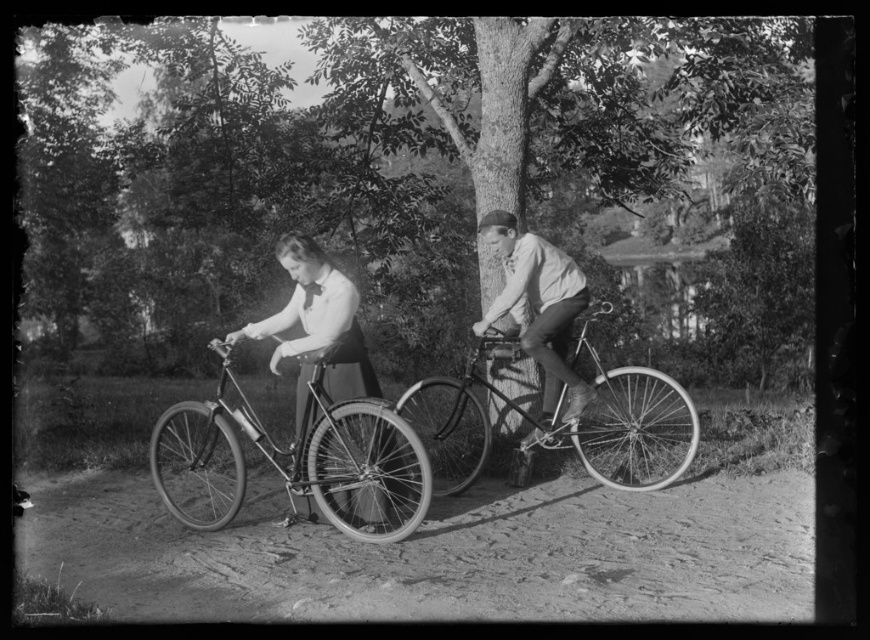
Who is more distant from viewer, (547, 432) or (304, 324)?

The point (547, 432) is more distant.

Who is more distant from viewer, [516,451] or [283,308]?

The point [516,451] is more distant.

Locate an element on the screen. Image resolution: width=870 pixels, height=640 pixels. metallic polished bicycle at center is located at coordinates (580, 417).

Is dirt track at lower center wider than metallic polished bicycle at center?

Indeed, dirt track at lower center has a greater width compared to metallic polished bicycle at center.

Which is more to the left, dirt track at lower center or metallic polished bicycle at center?

dirt track at lower center is more to the left.

Measure the distance between point (465, 525) and camera.

A distance of 22.17 feet exists between point (465, 525) and camera.

Where is `dirt track at lower center`? dirt track at lower center is located at coordinates (440, 554).

Can you confirm if shiny metal bicycle at center is smaller than metallic polished bicycle at center?

Yes, shiny metal bicycle at center is smaller than metallic polished bicycle at center.

Between shiny metal bicycle at center and metallic polished bicycle at center, which one has less height?

Standing shorter between the two is metallic polished bicycle at center.

Is point (356, 381) more distant than point (609, 477)?

No, it is in front of (609, 477).

The width and height of the screenshot is (870, 640). I want to click on shiny metal bicycle at center, so click(x=537, y=308).